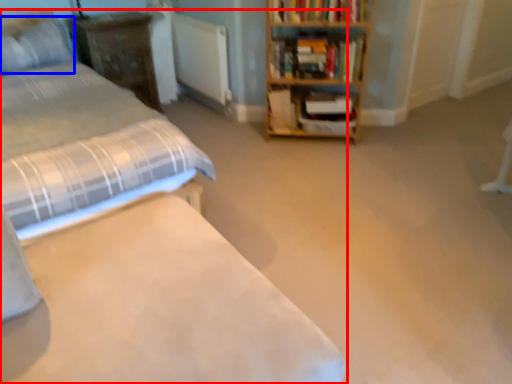
Question: Which object appears farthest to the camera in this image, bed (highlighted by a red box) or pillow (highlighted by a blue box)?

Choices:
 (A) bed
 (B) pillow

Answer: (B)